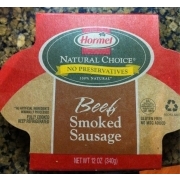
Locate an element on the screen. This screenshot has width=180, height=180. bottom of counter is located at coordinates (17, 171).